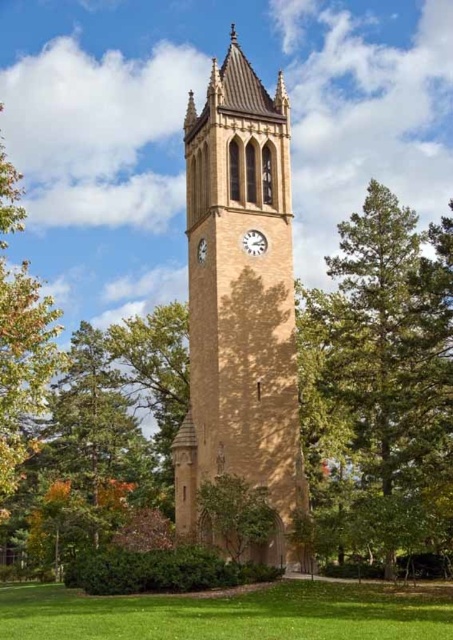
Is point (266, 291) positioned behind point (443, 294)?

Yes, it is.

Is point (290, 506) closer to viewer compared to point (395, 433)?

Yes.

Image resolution: width=453 pixels, height=640 pixels. Identify the location of yellow stone clock tower at center. (240, 301).

Is yellow stone clock tower at center below metallic silver clock at center?

No, yellow stone clock tower at center is not below metallic silver clock at center.

Is point (251, 401) less distant than point (252, 241)?

Yes, point (251, 401) is in front of point (252, 241).

You are a GUI agent. You are given a task and a screenshot of the screen. Output one action in this format:
    pyautogui.click(x=<x>, y=<y>)
    Task: Click on the yellow stone clock tower at center
    The height and width of the screenshot is (640, 453).
    Given the screenshot: What is the action you would take?
    pyautogui.click(x=240, y=301)

In the scene shown: Is green leafy tree at lower center above metallic silver clock at center?

No.

Is point (226, 522) farther from viewer compared to point (255, 230)?

No, (226, 522) is in front of (255, 230).

I want to click on green leafy tree at lower center, so click(235, 515).